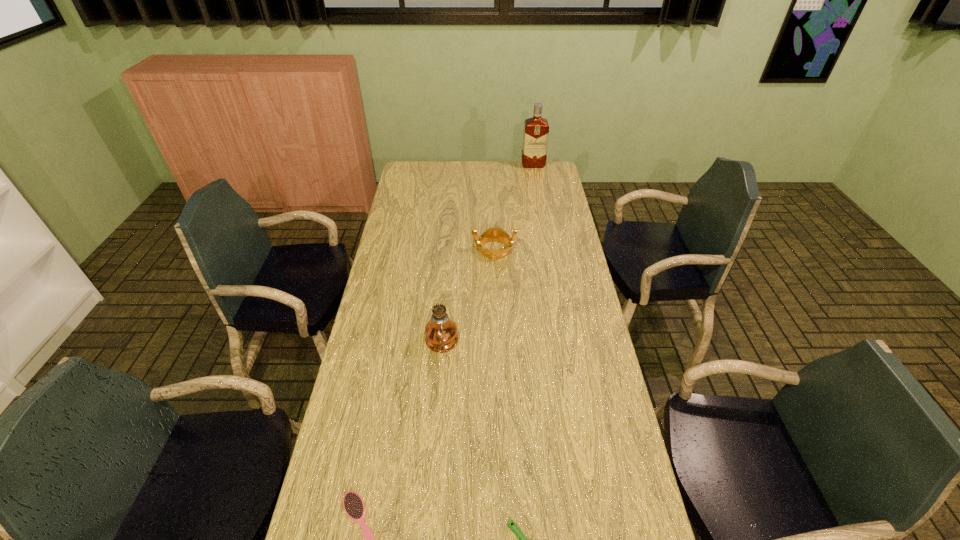
Image resolution: width=960 pixels, height=540 pixels. Identify the location of free space located at the front emblem of the fourth nearest object. coord(402,249).

You are a GUI agent. You are given a task and a screenshot of the screen. Output one action in this format:
    pyautogui.click(x=<x>, y=<y>)
    Task: Click on the object located at the far edge
    
    Given the screenshot: What is the action you would take?
    pyautogui.click(x=536, y=129)

The image size is (960, 540). What are the coordinates of `object present at the right edge` in the screenshot? It's located at (536, 129).

Identify the location of object present at the far right corner. (536, 129).

In the image, there is a desktop. Where is `vacant space at the far edge`? vacant space at the far edge is located at coordinates (481, 169).

Locate an element on the screen. free space at the left edge of the desktop is located at coordinates (395, 224).

In the image, there is a desktop. Where is `free region at the right edge`? This screenshot has width=960, height=540. free region at the right edge is located at coordinates (574, 426).

Locate an element on the screen. The width and height of the screenshot is (960, 540). free space between the third shortest object and the liquor is located at coordinates (514, 207).

What are the coordinates of `unoccupied position between the third tallest object and the liquor` in the screenshot? It's located at (514, 207).

Locate an element on the screen. The width and height of the screenshot is (960, 540). the closest object to the left hairbrush is located at coordinates (514, 528).